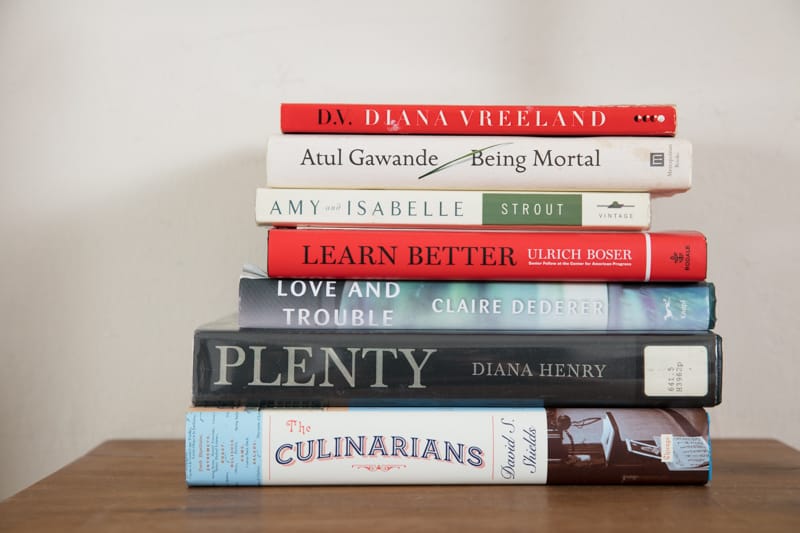
Where is `books`? books is located at coordinates (456, 111), (466, 159), (469, 201), (496, 306), (484, 255), (496, 365), (396, 461).